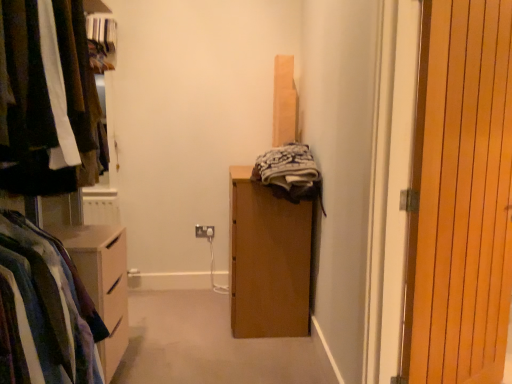
Question: Does white plastic electric outlet at center touch wooden at right?

Choices:
 (A) yes
 (B) no

Answer: (B)

Question: From a real-world perspective, does white plastic electric outlet at center sit lower than wooden at right?

Choices:
 (A) no
 (B) yes

Answer: (B)

Question: From the image's perspective, is white plastic electric outlet at center beneath wooden at right?

Choices:
 (A) no
 (B) yes

Answer: (B)

Question: Can you confirm if white plastic electric outlet at center is wider than wooden at right?

Choices:
 (A) yes
 (B) no

Answer: (B)

Question: Can you confirm if white plastic electric outlet at center is taller than wooden at right?

Choices:
 (A) yes
 (B) no

Answer: (B)

Question: Is wooden at right completely or partially inside white plastic electric outlet at center?

Choices:
 (A) yes
 (B) no

Answer: (B)

Question: Does wooden at right have a lesser width compared to matte black clothes at left?

Choices:
 (A) yes
 (B) no

Answer: (A)

Question: From the image's perspective, is wooden at right under matte black clothes at left?

Choices:
 (A) no
 (B) yes

Answer: (B)

Question: From a real-world perspective, is wooden at right positioned over matte black clothes at left based on gravity?

Choices:
 (A) yes
 (B) no

Answer: (B)

Question: Is wooden at right oriented away from matte black clothes at left?

Choices:
 (A) no
 (B) yes

Answer: (A)

Question: Is wooden at right next to matte black clothes at left?

Choices:
 (A) yes
 (B) no

Answer: (B)

Question: Does wooden at right have a greater height compared to matte black clothes at left?

Choices:
 (A) no
 (B) yes

Answer: (B)

Question: Is matte black clothes at left completely or partially outside of white plastic electric outlet at center?

Choices:
 (A) no
 (B) yes

Answer: (B)